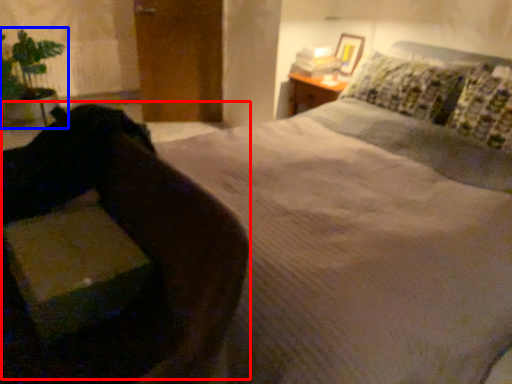
Question: Which of the following is the closest to the observer, swivel chair (highlighted by a red box) or houseplant (highlighted by a blue box)?

Choices:
 (A) swivel chair
 (B) houseplant

Answer: (A)